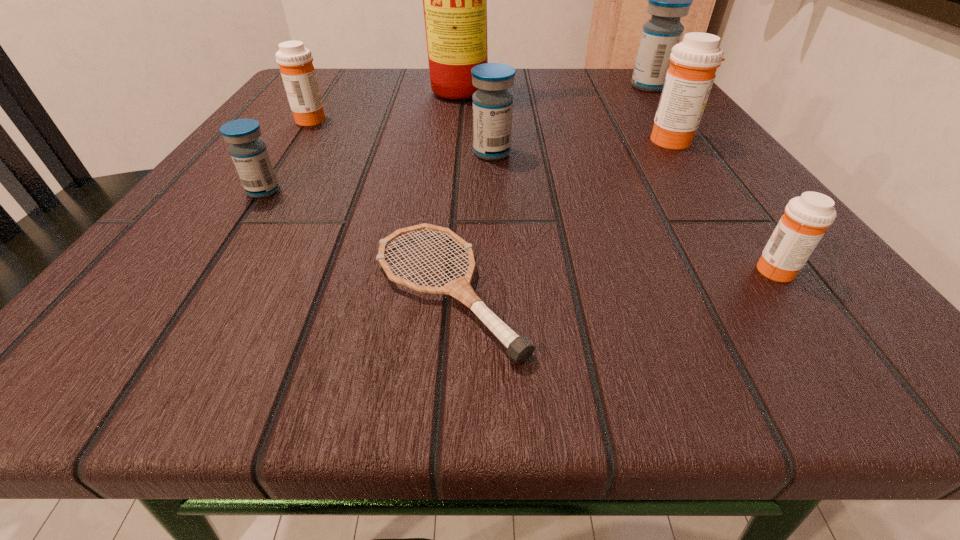
At what (x,y) coordinates should I click in order to perform the action: click on free region at the right edge of the desktop. Please return your answer as a coordinate pair (x, y). This screenshot has height=540, width=960. Looking at the image, I should click on (742, 186).

The height and width of the screenshot is (540, 960). In order to click on vacant space at the far left corner in this screenshot , I will do `click(328, 83)`.

Locate an element on the screen. The height and width of the screenshot is (540, 960). vacant space at the near left corner of the desktop is located at coordinates (215, 318).

Where is `free region at the far right corner of the desktop`? The width and height of the screenshot is (960, 540). free region at the far right corner of the desktop is located at coordinates [587, 83].

Image resolution: width=960 pixels, height=540 pixels. Identify the location of vacant area that lies between the second nearest orange medicine and the tennis racket. (562, 215).

Identify the location of vacant space that is in between the leftmost blue medicine and the tennis racket. (356, 241).

Where is `free space between the second blue medicine from left to right and the second farthest medicine`? This screenshot has height=540, width=960. free space between the second blue medicine from left to right and the second farthest medicine is located at coordinates (400, 136).

Where is `free space between the red fire extinguisher and the second farthest orange medicine`? The width and height of the screenshot is (960, 540). free space between the red fire extinguisher and the second farthest orange medicine is located at coordinates (571, 116).

You are a GUI agent. You are given a task and a screenshot of the screen. Output one action in this format:
    pyautogui.click(x=<x>, y=<y>)
    Task: Click on the free spot between the biggest orange medicine and the second nearest blue medicine
    
    Given the screenshot: What is the action you would take?
    pyautogui.click(x=583, y=146)

Find the location of a particular element. Image resolution: width=960 pixels, height=540 pixels. vacant space in between the second biggest blue medicine and the nearest medicine is located at coordinates (634, 211).